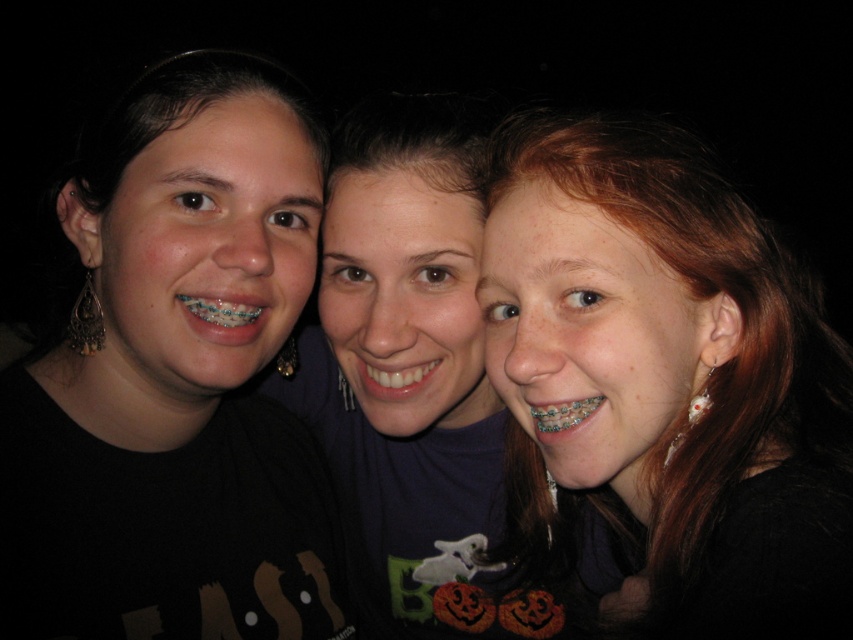
Can you confirm if black matte shirt at left is wider than matte purple shirt at center?

No, black matte shirt at left is not wider than matte purple shirt at center.

Looking at this image, is the position of black matte shirt at left less distant than that of matte purple shirt at center?

Yes, black matte shirt at left is closer to the viewer.

Which is in front, point (96, 161) or point (372, 164)?

Point (96, 161)

The height and width of the screenshot is (640, 853). I want to click on black matte shirt at left, so click(175, 381).

Can you confirm if matte purple shirt at center is shorter than metallic braces at center?

No.

From the picture: Can you confirm if matte purple shirt at center is taller than metallic braces at center?

Correct, matte purple shirt at center is much taller as metallic braces at center.

Between point (450, 122) and point (247, 339), which one is positioned in front?

Point (247, 339) is in front.

This screenshot has width=853, height=640. Find the location of `matte purple shirt at center`. matte purple shirt at center is located at coordinates click(424, 387).

Does white glossy teeth at center come behind metallic braces at center?

Yes.

Measure the distance between white glossy teeth at center and metallic braces at center.

white glossy teeth at center and metallic braces at center are 6.47 inches apart.

Who is more forward, (376, 380) or (235, 339)?

Positioned in front is point (235, 339).

This screenshot has width=853, height=640. Identify the location of white glossy teeth at center. (393, 376).